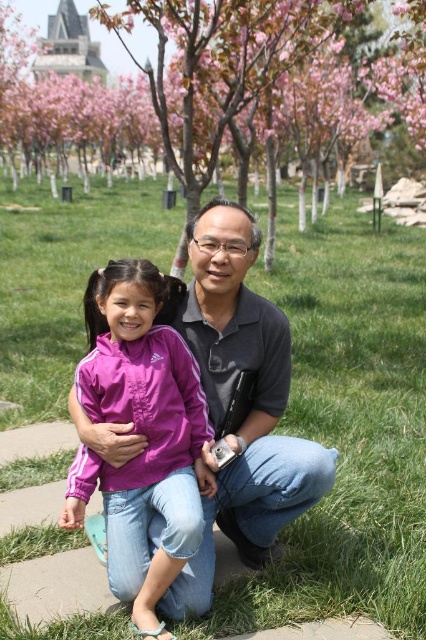
The height and width of the screenshot is (640, 426). What do you see at coordinates (348, 426) in the screenshot?
I see `green grass at center` at bounding box center [348, 426].

Does green grass at center have a lesser width compared to pink blossoms at upper center?

Correct, green grass at center's width is less than pink blossoms at upper center's.

Which is in front, point (28, 412) or point (290, 72)?

Point (28, 412) is more forward.

Identify the location of green grass at center. The width and height of the screenshot is (426, 640). (348, 426).

Does green grass at center appear on the right side of pink fabric jacket at center?

Yes, green grass at center is to the right of pink fabric jacket at center.

Measure the distance between green grass at center and camera.

green grass at center is 3.38 meters away from camera.

I want to click on green grass at center, so click(x=348, y=426).

Does point (166, 156) come in front of point (158, 586)?

No.

Does pink blossoms at upper center appear under pink fabric jacket at center?

Actually, pink blossoms at upper center is above pink fabric jacket at center.

Is point (301, 115) farther from camera compared to point (164, 625)?

Yes, it is behind point (164, 625).

In order to click on pink blossoms at upper center in this screenshot , I will do `click(232, 96)`.